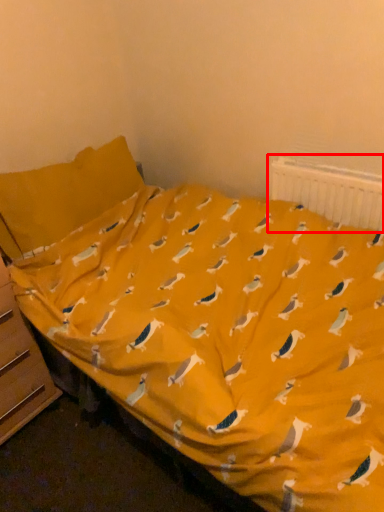
Question: In this image, where is radiator (annotated by the red box) located relative to file cabinet?

Choices:
 (A) right
 (B) left

Answer: (A)